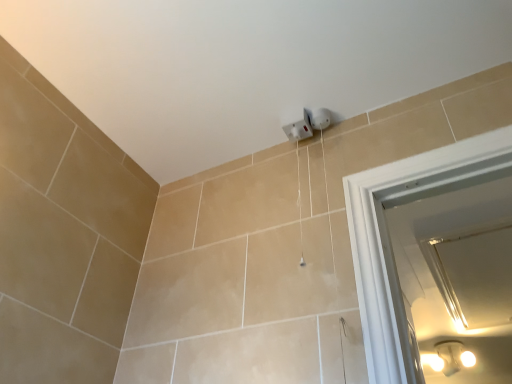
Where is `white plastic door at upper right`? white plastic door at upper right is located at coordinates (436, 262).

This screenshot has width=512, height=384. What do you see at coordinates (436, 262) in the screenshot?
I see `white plastic door at upper right` at bounding box center [436, 262].

I want to click on white plastic door at upper right, so click(436, 262).